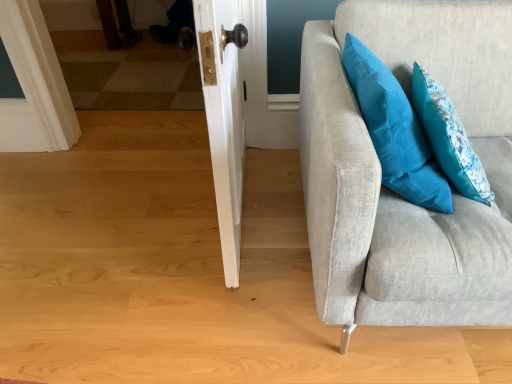
Question: Considering the relative sizes of teal fabric pillow at upper right, which is counted as the 2th pillow, starting from the left, and teal fabric pillow at upper right, the 1th pillow when ordered from left to right, in the image provided, is teal fabric pillow at upper right, which is counted as the 2th pillow, starting from the left, bigger than teal fabric pillow at upper right, the 1th pillow when ordered from left to right,?

Choices:
 (A) yes
 (B) no

Answer: (B)

Question: Can you confirm if teal fabric pillow at upper right, which is counted as the 2th pillow, starting from the left, is smaller than teal fabric pillow at upper right, positioned as the 2th pillow in right-to-left order?

Choices:
 (A) no
 (B) yes

Answer: (B)

Question: From a real-world perspective, is teal fabric pillow at upper right, placed as the 1th pillow when sorted from right to left, under teal fabric pillow at upper right, the 1th pillow when ordered from left to right?

Choices:
 (A) no
 (B) yes

Answer: (B)

Question: Can you confirm if teal fabric pillow at upper right, placed as the 1th pillow when sorted from right to left, is positioned to the left of teal fabric pillow at upper right, the 1th pillow when ordered from left to right?

Choices:
 (A) no
 (B) yes

Answer: (A)

Question: Considering the relative sizes of teal fabric pillow at upper right, placed as the 1th pillow when sorted from right to left, and teal fabric pillow at upper right, the 1th pillow when ordered from left to right, in the image provided, is teal fabric pillow at upper right, placed as the 1th pillow when sorted from right to left, thinner than teal fabric pillow at upper right, the 1th pillow when ordered from left to right,?

Choices:
 (A) yes
 (B) no

Answer: (A)

Question: Can you confirm if teal fabric pillow at upper right, placed as the 1th pillow when sorted from right to left, is wider than teal fabric pillow at upper right, positioned as the 2th pillow in right-to-left order?

Choices:
 (A) no
 (B) yes

Answer: (A)

Question: From the image's perspective, would you say light gray fabric couch at right is positioned over teal fabric pillow at upper right, the 1th pillow when ordered from left to right?

Choices:
 (A) yes
 (B) no

Answer: (B)

Question: Is light gray fabric couch at right next to teal fabric pillow at upper right, positioned as the 2th pillow in right-to-left order, and touching it?

Choices:
 (A) yes
 (B) no

Answer: (B)

Question: Is light gray fabric couch at right taller than teal fabric pillow at upper right, positioned as the 2th pillow in right-to-left order?

Choices:
 (A) yes
 (B) no

Answer: (A)

Question: Can you confirm if light gray fabric couch at right is positioned to the right of teal fabric pillow at upper right, positioned as the 2th pillow in right-to-left order?

Choices:
 (A) no
 (B) yes

Answer: (B)

Question: Is light gray fabric couch at right thinner than teal fabric pillow at upper right, positioned as the 2th pillow in right-to-left order?

Choices:
 (A) yes
 (B) no

Answer: (B)

Question: Is teal fabric pillow at upper right, positioned as the 2th pillow in right-to-left order, inside light gray fabric couch at right?

Choices:
 (A) yes
 (B) no

Answer: (A)

Question: Does teal fabric pillow at upper right, positioned as the 2th pillow in right-to-left order, have a larger size compared to light gray fabric couch at right?

Choices:
 (A) no
 (B) yes

Answer: (A)